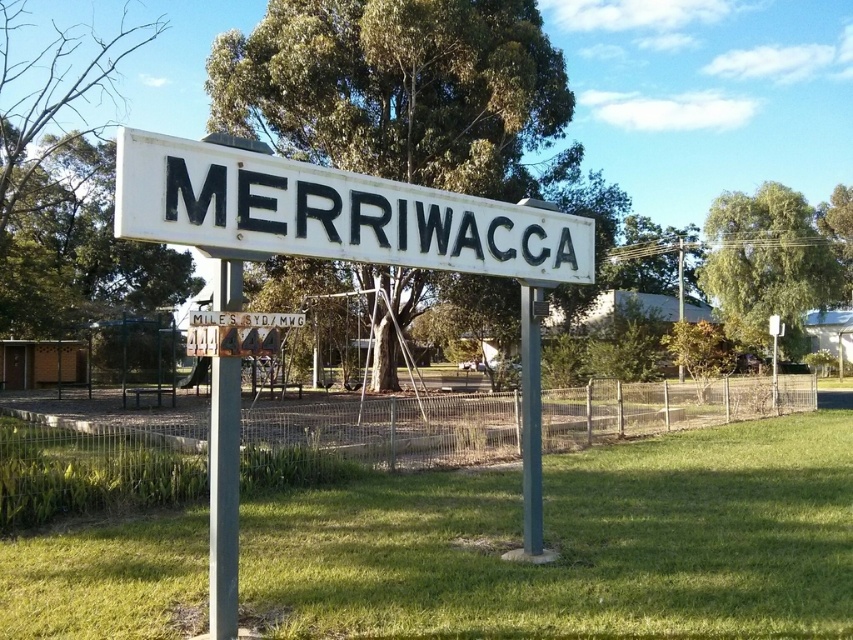
Describe the element at coordinates (573, 544) in the screenshot. I see `green grass at center` at that location.

Can you confirm if green grass at center is shorter than green painted metal pole at center?

Yes, green grass at center is shorter than green painted metal pole at center.

At what (x,y) coordinates should I click in order to perform the action: click on green grass at center. Please return your answer as a coordinate pair (x, y). The height and width of the screenshot is (640, 853). Looking at the image, I should click on (573, 544).

Is point (558, 253) more distant than point (534, 381)?

Yes, it is behind point (534, 381).

Between point (260, 248) and point (520, 314), which one is positioned behind?

Positioned behind is point (520, 314).

Is point (473, 259) closer to viewer compared to point (534, 291)?

Yes, it is in front of point (534, 291).

Identify the location of white matte sign at center. (334, 214).

Is point (640, 540) positioned in front of point (577, 282)?

No, (640, 540) is behind (577, 282).

Is point (392, 499) closer to camera compared to point (218, 182)?

No, it is behind (218, 182).

You are a GUI agent. You are given a task and a screenshot of the screen. Output one action in this format:
    pyautogui.click(x=<x>, y=<y>)
    Task: Click on the green grass at center
    The image size is (853, 640).
    Given the screenshot: What is the action you would take?
    pyautogui.click(x=573, y=544)